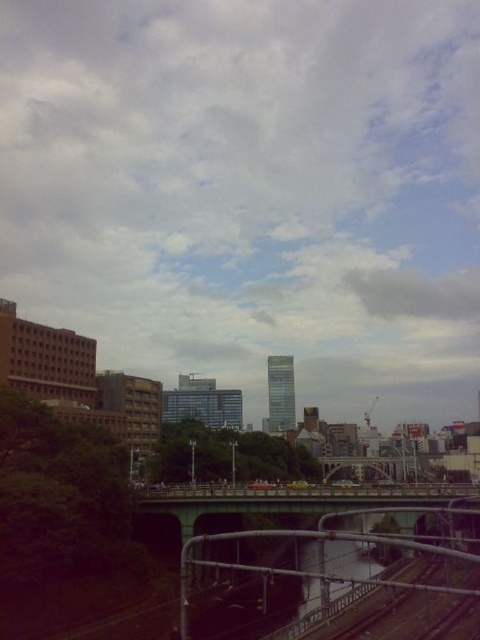
Question: Can you confirm if green concrete bridge at center is smaller than metallic gray bridge at center?

Choices:
 (A) no
 (B) yes

Answer: (B)

Question: Which point appears closest to the camera in this image?

Choices:
 (A) pyautogui.click(x=321, y=464)
 (B) pyautogui.click(x=230, y=509)

Answer: (B)

Question: Which point is closer to the camera?

Choices:
 (A) green concrete bridge at center
 (B) metallic gray bridge at center

Answer: (A)

Question: From the image, what is the correct spatial relationship of green concrete bridge at center in relation to metallic gray bridge at center?

Choices:
 (A) above
 (B) below

Answer: (A)

Question: Is the position of green concrete bridge at center less distant than that of metallic gray bridge at center?

Choices:
 (A) yes
 (B) no

Answer: (A)